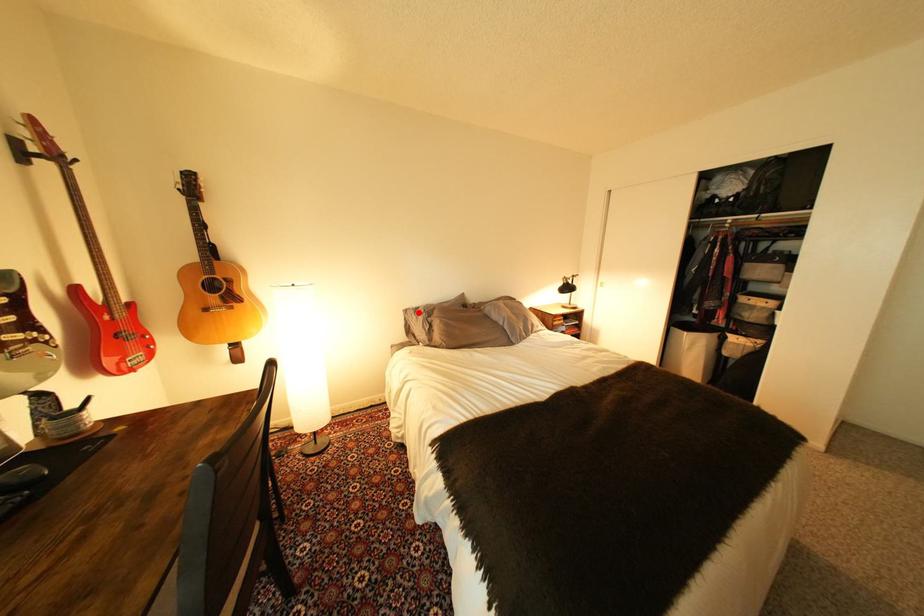
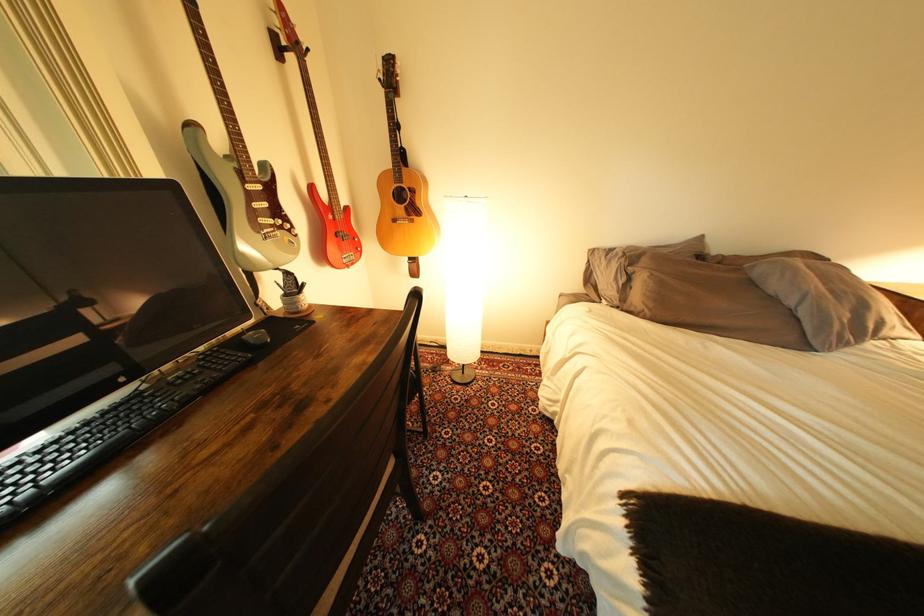
Find the pixel in the second image that matches the highlighted location in the first image.

(604, 253)